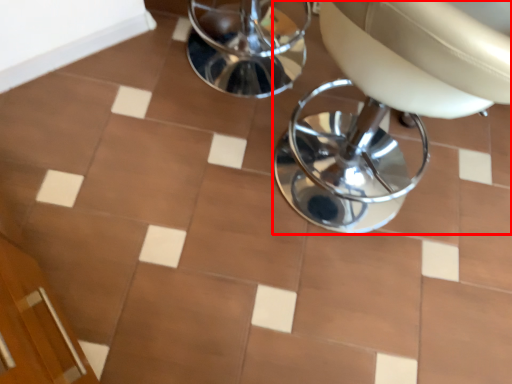
Question: From the image's perspective, considering the relative positions of chair (annotated by the red box) and ceramic tile in the image provided, where is chair (annotated by the red box) located with respect to the staircase?

Choices:
 (A) above
 (B) below

Answer: (B)